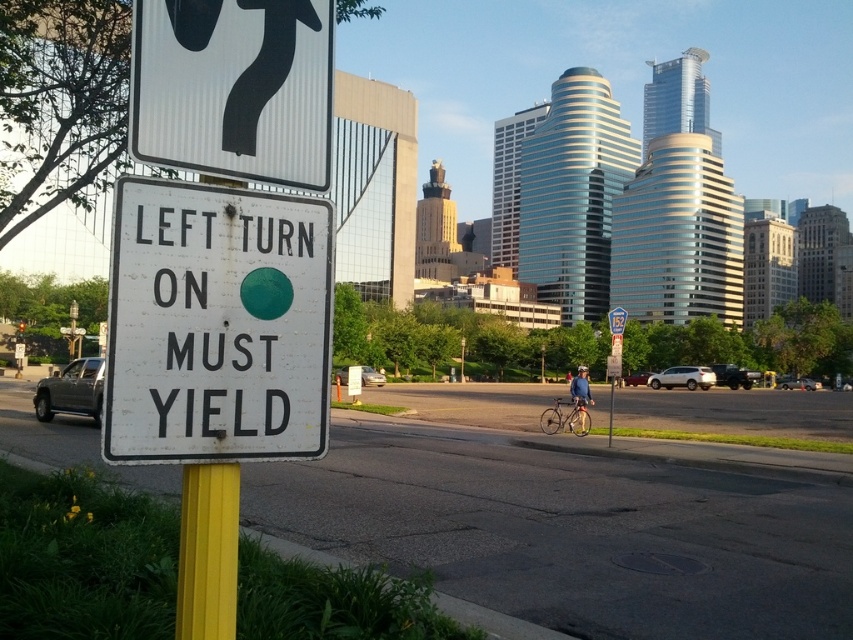
Is yellow painted metal pole at lower left closer to camera compared to blue fabric jacket at center?

Yes, it is.

Is yellow painted metal pole at lower left further to camera compared to blue fabric jacket at center?

That is False.

Between point (202, 637) and point (584, 392), which one is positioned behind?

Point (584, 392)

What are the coordinates of `yellow painted metal pole at lower left` in the screenshot? It's located at (207, 552).

Does point (573, 401) come farther from viewer compared to point (582, 376)?

No, it is not.

Between silver metallic bicycle at center and blue fabric jacket at center, which one is positioned higher?

silver metallic bicycle at center is above.

Between point (569, 413) and point (581, 401), which one is positioned behind?

Positioned behind is point (569, 413).

I want to click on silver metallic bicycle at center, so click(566, 417).

Does white paper sign at center appear on the left side of white corrugated plastic sign at upper left?

Correct, you'll find white paper sign at center to the left of white corrugated plastic sign at upper left.

Between white paper sign at center and white corrugated plastic sign at upper left, which one has less height?

With less height is white corrugated plastic sign at upper left.

Is point (115, 250) closer to viewer compared to point (260, 92)?

Yes, point (115, 250) is closer to viewer.

The width and height of the screenshot is (853, 640). I want to click on white paper sign at center, so pyautogui.click(x=218, y=324).